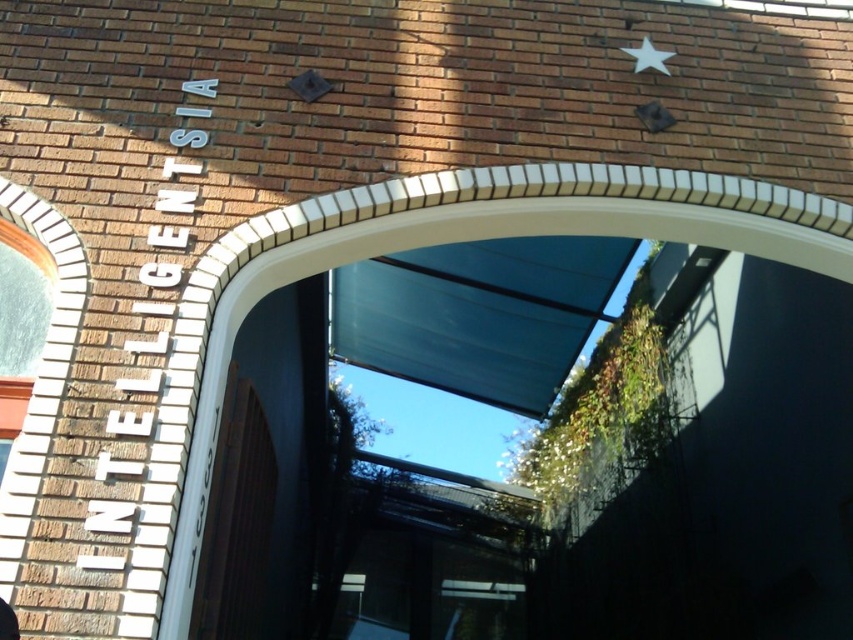
Question: Can you confirm if white brick archway at center is positioned to the left of white matte star at upper right?

Choices:
 (A) yes
 (B) no

Answer: (A)

Question: Which point appears farthest from the camera in this image?

Choices:
 (A) (213, 314)
 (B) (645, 64)

Answer: (B)

Question: Can you confirm if white brick archway at center is bigger than white matte star at upper right?

Choices:
 (A) yes
 (B) no

Answer: (A)

Question: Among these objects, which one is farthest from the camera?

Choices:
 (A) white matte star at upper right
 (B) white brick archway at center

Answer: (A)

Question: Which object appears farthest from the camera in this image?

Choices:
 (A) white matte star at upper right
 (B) white brick archway at center

Answer: (A)

Question: Can you confirm if white brick archway at center is positioned to the left of white matte star at upper right?

Choices:
 (A) yes
 (B) no

Answer: (A)